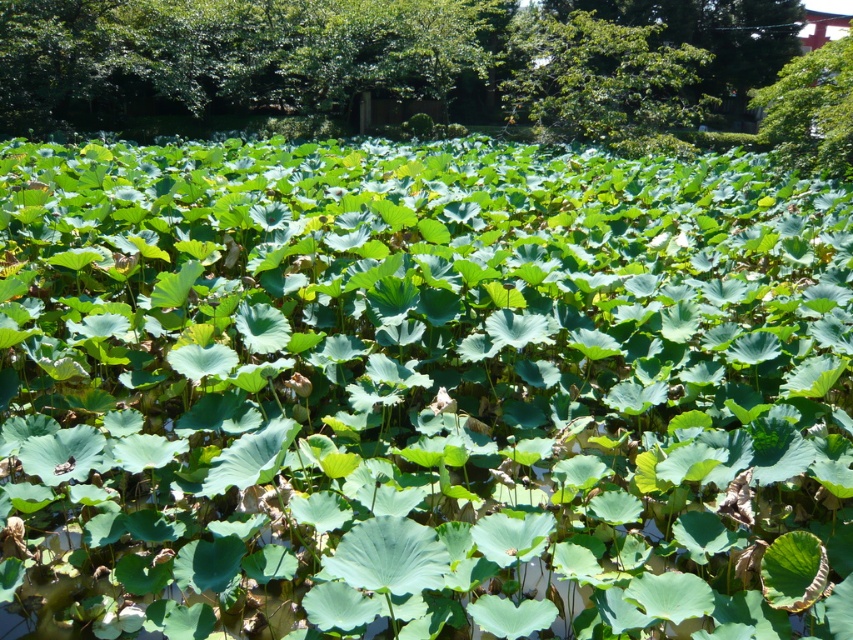
Where is `green leafy tree at upper center`? green leafy tree at upper center is located at coordinates (602, 81).

Between point (524, 26) and point (770, 109), which one is positioned in front?

Point (770, 109) is more forward.

Is point (572, 70) more distant than point (819, 106)?

Yes, point (572, 70) is farther from viewer.

Identify the location of green leafy tree at upper center. The image size is (853, 640). (602, 81).